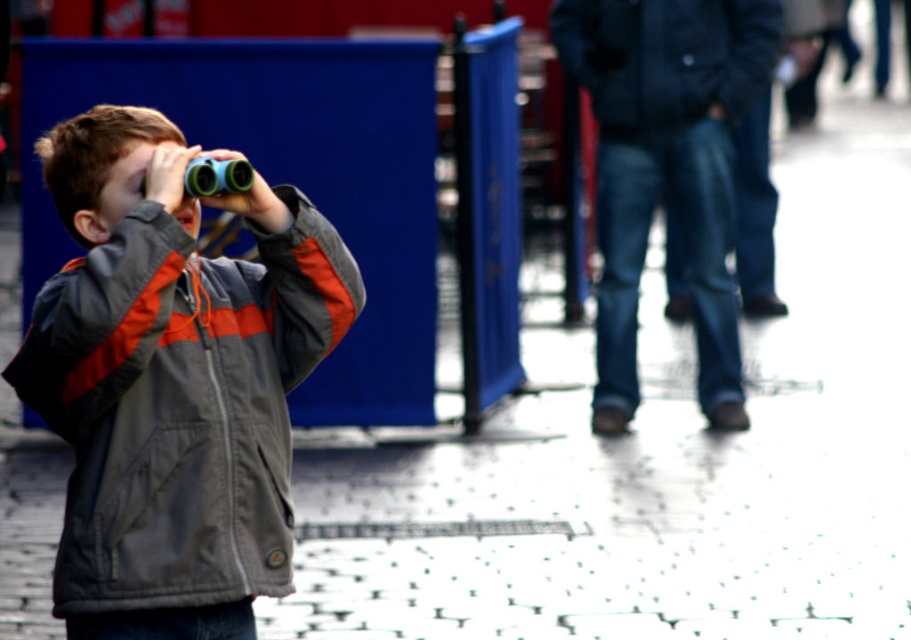
You are a tailor who needs to determine which jacket requires more fabric for alterations. Based on the image, which jacket between the gray fabric jacket at center and the dark blue jacket at upper right would need more fabric due to its larger size?

The dark blue jacket at upper right requires more fabric for alterations because its width is greater than the gray fabric jacket at center.

Based on the coordinates provided, where is the gray fabric jacket at center located in the image?

The gray fabric jacket at center is located at the 2D coordinates point [173,380].

You are standing at the point with coordinates point (722, 83) and want to walk to the point with coordinates point (103, 337). According to the image, which direction should you face to move towards your destination?

To move from point (722, 83) to point (103, 337), you should face downward and to the right because point (103, 337) is located below and to the right of point (722, 83) in the image.